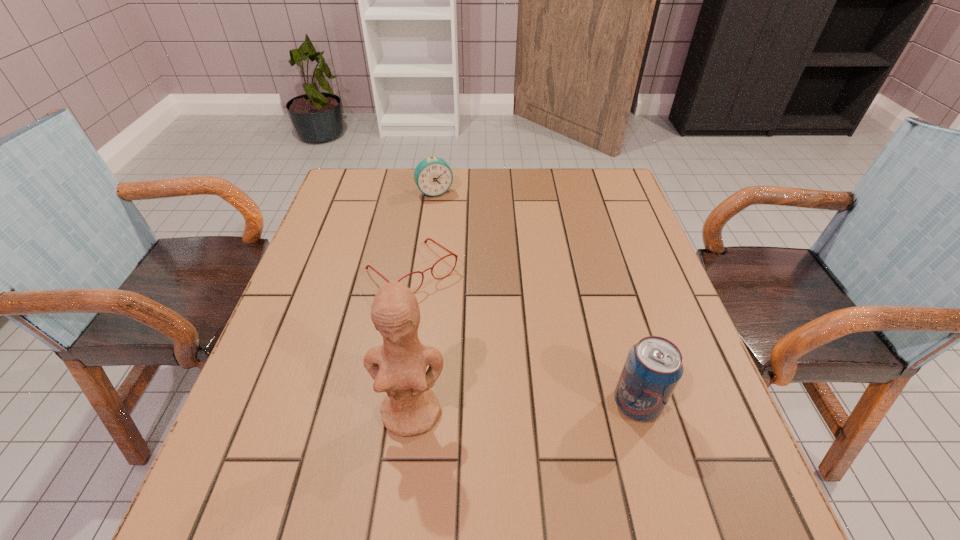
Find the location of `free region located on the face of the spectacles`. free region located on the face of the spectacles is located at coordinates (484, 341).

Identify the location of vacant point located 0.210m on the front-facing side of the second shortest object. This screenshot has height=540, width=960. (462, 242).

The height and width of the screenshot is (540, 960). What are the coordinates of `vacant area situated 0.280m on the front-facing side of the second shortest object` in the screenshot? It's located at (469, 259).

Where is `vacant space situated on the front-facing side of the second shortest object`? vacant space situated on the front-facing side of the second shortest object is located at coordinates (477, 274).

I want to click on object present at the far edge, so click(433, 176).

This screenshot has height=540, width=960. In order to click on figurine that is positioned at the near edge in this screenshot , I will do `click(398, 367)`.

At what (x,y) coordinates should I click in order to perform the action: click on pop soda located in the near edge section of the desktop. Please return your answer as a coordinate pair (x, y). This screenshot has height=540, width=960. Looking at the image, I should click on (653, 368).

At what (x,y) coordinates should I click in order to perform the action: click on object at the left edge. Please return your answer as a coordinate pair (x, y). Looking at the image, I should click on (425, 241).

Locate an element on the screen. object at the right edge is located at coordinates (653, 368).

Where is `object located at the near right corner`? The width and height of the screenshot is (960, 540). object located at the near right corner is located at coordinates (653, 368).